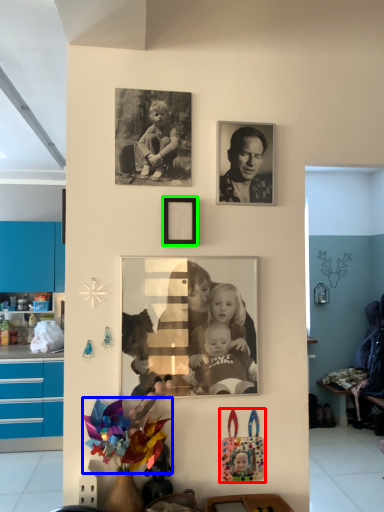
Question: Which object is the closest to the toy (highlighted by a red box)? Choose among these: flower (highlighted by a blue box) or picture frame (highlighted by a green box).

Choices:
 (A) flower
 (B) picture frame

Answer: (A)